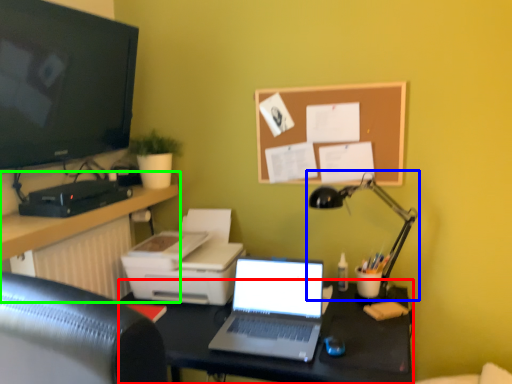
Question: Considering the real-world distances, which object is closest to desk (highlighted by a red box)? lamp (highlighted by a blue box) or computer desk (highlighted by a green box).

Choices:
 (A) lamp
 (B) computer desk

Answer: (A)